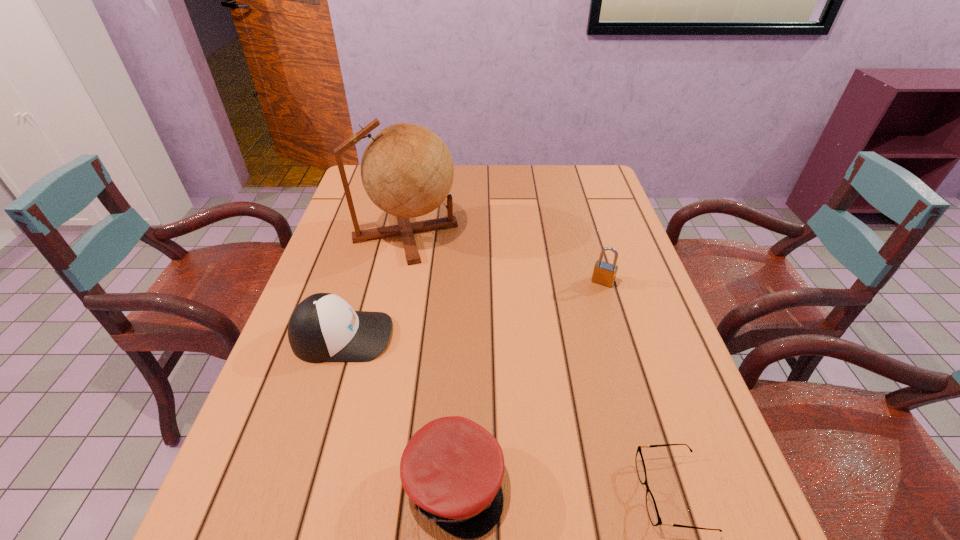
At what (x,y) coordinates should I click in order to perform the action: click on the farthest object. Please return your answer as a coordinate pair (x, y). Looking at the image, I should click on (407, 170).

Locate an element on the screen. This screenshot has width=960, height=540. the tallest object is located at coordinates (407, 170).

This screenshot has width=960, height=540. What are the coordinates of `padlock` in the screenshot? It's located at (604, 273).

Where is `the farther cap`? This screenshot has width=960, height=540. the farther cap is located at coordinates (323, 328).

Where is `the left cap`? the left cap is located at coordinates (323, 328).

Where is `the right cap`? the right cap is located at coordinates (452, 468).

Locate an element on the screen. Image resolution: width=960 pixels, height=540 pixels. the shorter cap is located at coordinates tap(452, 468).

Where is `the shortest object`? The height and width of the screenshot is (540, 960). the shortest object is located at coordinates (652, 509).

I want to click on vacant area located on the surface of the farthest object, so click(563, 232).

Image resolution: width=960 pixels, height=540 pixels. What are the coordinates of `vacant region located 0.390m on the back of the padlock` in the screenshot? It's located at (577, 197).